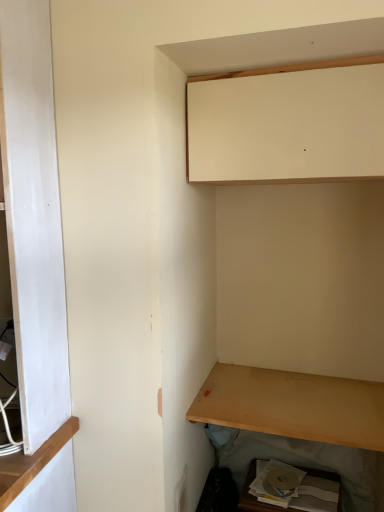
You are a GUI agent. You are given a task and a screenshot of the screen. Output one action in this format:
    pyautogui.click(x=<x>, y=<y>)
    Task: Click on the matte cardboard box at lower right, placed as the 1th cabinetry when sorted from bottom to top
    The width and height of the screenshot is (384, 512).
    Given the screenshot: What is the action you would take?
    pyautogui.click(x=251, y=495)

You are a GUI agent. You are given a task and a screenshot of the screen. Output one action in this format:
    pyautogui.click(x=<x>, y=<y>)
    Task: Click on the light brown wood shelf at lower right
    This screenshot has width=384, height=512.
    Given the screenshot: What is the action you would take?
    pyautogui.click(x=293, y=405)

Consider the image. Is light brown wood shelf at lower right taller or shorter than matte white cabinet at upper center, the 1th cabinetry viewed from the top?

Considering their sizes, light brown wood shelf at lower right has less height than matte white cabinet at upper center, the 1th cabinetry viewed from the top.

At what (x,y) coordinates should I click in order to perform the action: click on cabinetry that is above the light brown wood shelf at lower right (from a real-world perspective). Please return your answer as a coordinate pair (x, y). Looking at the image, I should click on (288, 123).

Which of these two, light brown wood shelf at lower right or matte white cabinet at upper center, which is the second cabinetry in bottom-to-top order, is smaller?

light brown wood shelf at lower right is smaller.

In the scene shown: From a real-world perspective, which object rests below the other?

light brown wood shelf at lower right, from a real-world perspective.

Which is farther from the camera, (247, 488) or (245, 412)?

The point (247, 488) is more distant.

From a real-world perspective, between matte cardboard box at lower right, acting as the 2th cabinetry starting from the top, and light brown wood shelf at lower right, who is vertically higher?

Answer: light brown wood shelf at lower right, from a real-world perspective.

Can you confirm if matte cardboard box at lower right, placed as the 1th cabinetry when sorted from bottom to top, is thinner than light brown wood shelf at lower right?

Yes, matte cardboard box at lower right, placed as the 1th cabinetry when sorted from bottom to top, is thinner than light brown wood shelf at lower right.

From the image's perspective, does light brown wood shelf at lower right appear lower than matte cardboard box at lower right, acting as the 2th cabinetry starting from the top?

No, from the image's perspective, light brown wood shelf at lower right is not beneath matte cardboard box at lower right, acting as the 2th cabinetry starting from the top.

From a real-world perspective, between light brown wood shelf at lower right and matte cardboard box at lower right, placed as the 1th cabinetry when sorted from bottom to top, who is vertically higher?

light brown wood shelf at lower right is physically above.

Considering the positions of point (190, 407) and point (323, 478), is point (190, 407) closer or farther from the camera than point (323, 478)?

Point (190, 407).

Looking at this image, how much distance is there between light brown wood shelf at lower right and matte cardboard box at lower right, placed as the 1th cabinetry when sorted from bottom to top?

A distance of 14.36 inches exists between light brown wood shelf at lower right and matte cardboard box at lower right, placed as the 1th cabinetry when sorted from bottom to top.

From the image's perspective, is matte white cabinet at upper center, the 1th cabinetry viewed from the top, over light brown wood shelf at lower right?

Correct, matte white cabinet at upper center, the 1th cabinetry viewed from the top, appears higher than light brown wood shelf at lower right in the image.

Is point (237, 141) in front of point (271, 424)?

Yes, point (237, 141) is in front of point (271, 424).

Is the depth of matte white cabinet at upper center, which is the second cabinetry in bottom-to-top order, greater than that of light brown wood shelf at lower right?

No.

Is matte white cabinet at upper center, which is the second cabinetry in bottom-to-top order, aimed at matte cardboard box at lower right, acting as the 2th cabinetry starting from the top?

No.

In terms of size, does matte white cabinet at upper center, which is the second cabinetry in bottom-to-top order, appear bigger or smaller than matte cardboard box at lower right, acting as the 2th cabinetry starting from the top?

In the image, matte white cabinet at upper center, which is the second cabinetry in bottom-to-top order, appears to be larger than matte cardboard box at lower right, acting as the 2th cabinetry starting from the top.

Is matte white cabinet at upper center, the 1th cabinetry viewed from the top, situated inside matte cardboard box at lower right, acting as the 2th cabinetry starting from the top, or outside?

matte white cabinet at upper center, the 1th cabinetry viewed from the top, lies outside matte cardboard box at lower right, acting as the 2th cabinetry starting from the top.

Is point (306, 123) positioned in front of point (248, 494)?

Yes.

Between matte cardboard box at lower right, placed as the 1th cabinetry when sorted from bottom to top, and matte white cabinet at upper center, which is the second cabinetry in bottom-to-top order, which one appears on the right side from the viewer's perspective?

Positioned to the right is matte cardboard box at lower right, placed as the 1th cabinetry when sorted from bottom to top.

Considering the sizes of objects matte cardboard box at lower right, acting as the 2th cabinetry starting from the top, and matte white cabinet at upper center, the 1th cabinetry viewed from the top, in the image provided, who is smaller, matte cardboard box at lower right, acting as the 2th cabinetry starting from the top, or matte white cabinet at upper center, the 1th cabinetry viewed from the top,?

matte cardboard box at lower right, acting as the 2th cabinetry starting from the top.

Can you see matte cardboard box at lower right, acting as the 2th cabinetry starting from the top, touching matte white cabinet at upper center, which is the second cabinetry in bottom-to-top order?

No, matte cardboard box at lower right, acting as the 2th cabinetry starting from the top, is not in contact with matte white cabinet at upper center, which is the second cabinetry in bottom-to-top order.

From a real-world perspective, who is located higher, matte cardboard box at lower right, placed as the 1th cabinetry when sorted from bottom to top, or matte white cabinet at upper center, which is the second cabinetry in bottom-to-top order?

matte white cabinet at upper center, which is the second cabinetry in bottom-to-top order, from a real-world perspective.

Where is `shelf located on the right of matte white cabinet at upper center, the 1th cabinetry viewed from the top`? This screenshot has width=384, height=512. shelf located on the right of matte white cabinet at upper center, the 1th cabinetry viewed from the top is located at coordinates (293, 405).

Locate an element on the screen. The image size is (384, 512). shelf that appears above the matte cardboard box at lower right, acting as the 2th cabinetry starting from the top (from the image's perspective) is located at coordinates (293, 405).

From the image, which object appears to be nearer to light brown wood shelf at lower right, matte white cabinet at upper center, which is the second cabinetry in bottom-to-top order, or matte cardboard box at lower right, acting as the 2th cabinetry starting from the top?

Among the two, matte cardboard box at lower right, acting as the 2th cabinetry starting from the top, is located nearer to light brown wood shelf at lower right.

Looking at the image, which one is located closer to matte cardboard box at lower right, acting as the 2th cabinetry starting from the top, matte white cabinet at upper center, which is the second cabinetry in bottom-to-top order, or light brown wood shelf at lower right?

light brown wood shelf at lower right.

From the image, which object appears to be farther from matte cardboard box at lower right, placed as the 1th cabinetry when sorted from bottom to top, light brown wood shelf at lower right or matte white cabinet at upper center, the 1th cabinetry viewed from the top?

matte white cabinet at upper center, the 1th cabinetry viewed from the top, lies further to matte cardboard box at lower right, placed as the 1th cabinetry when sorted from bottom to top, than the other object.

Looking at this image, which object lies nearer to the anchor point light brown wood shelf at lower right, matte cardboard box at lower right, placed as the 1th cabinetry when sorted from bottom to top, or matte white cabinet at upper center, the 1th cabinetry viewed from the top?

matte cardboard box at lower right, placed as the 1th cabinetry when sorted from bottom to top, is closer to light brown wood shelf at lower right.

Which object lies further to the anchor point matte white cabinet at upper center, which is the second cabinetry in bottom-to-top order, light brown wood shelf at lower right or matte cardboard box at lower right, acting as the 2th cabinetry starting from the top?

The object further to matte white cabinet at upper center, which is the second cabinetry in bottom-to-top order, is matte cardboard box at lower right, acting as the 2th cabinetry starting from the top.

Which object lies further to the anchor point matte white cabinet at upper center, the 1th cabinetry viewed from the top, matte cardboard box at lower right, acting as the 2th cabinetry starting from the top, or light brown wood shelf at lower right?

The object further to matte white cabinet at upper center, the 1th cabinetry viewed from the top, is matte cardboard box at lower right, acting as the 2th cabinetry starting from the top.

Find the location of a particular element. This screenshot has width=384, height=512. shelf between matte white cabinet at upper center, which is the second cabinetry in bottom-to-top order, and matte cardboard box at lower right, acting as the 2th cabinetry starting from the top, vertically is located at coordinates (293, 405).